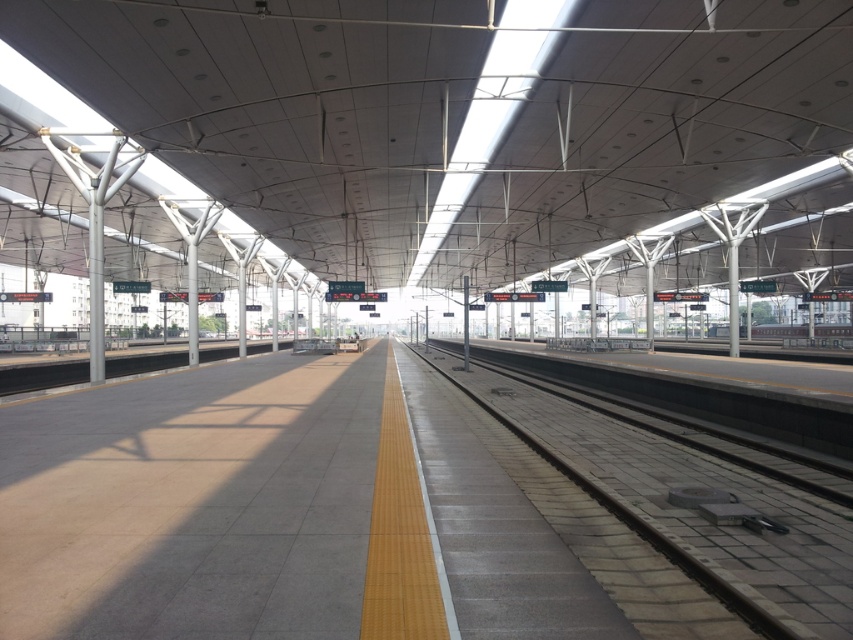
Question: Which of the following is the closest to the observer?

Choices:
 (A) silver metallic train at center
 (B) gray concrete train track at center

Answer: (B)

Question: Among these objects, which one is farthest from the camera?

Choices:
 (A) silver metallic train at center
 (B) gray concrete train track at center

Answer: (A)

Question: Is gray concrete train track at center smaller than silver metallic train at center?

Choices:
 (A) yes
 (B) no

Answer: (A)

Question: Which object is farther from the camera taking this photo?

Choices:
 (A) silver metallic train at center
 (B) gray concrete train track at center

Answer: (A)

Question: Can you confirm if gray concrete train track at center is bigger than silver metallic train at center?

Choices:
 (A) no
 (B) yes

Answer: (A)

Question: Does gray concrete train track at center lie behind silver metallic train at center?

Choices:
 (A) no
 (B) yes

Answer: (A)